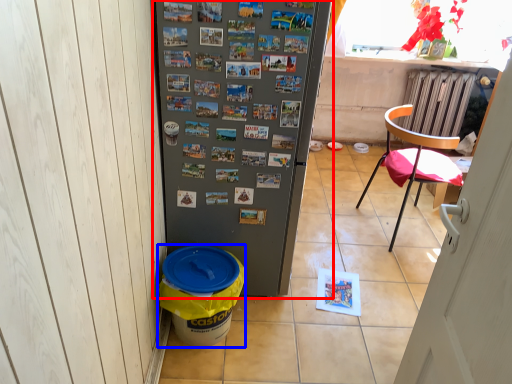
Question: Which of the following is the farthest to the observer, refrigerator (highlighted by a red box) or recycling bin (highlighted by a blue box)?

Choices:
 (A) refrigerator
 (B) recycling bin

Answer: (B)